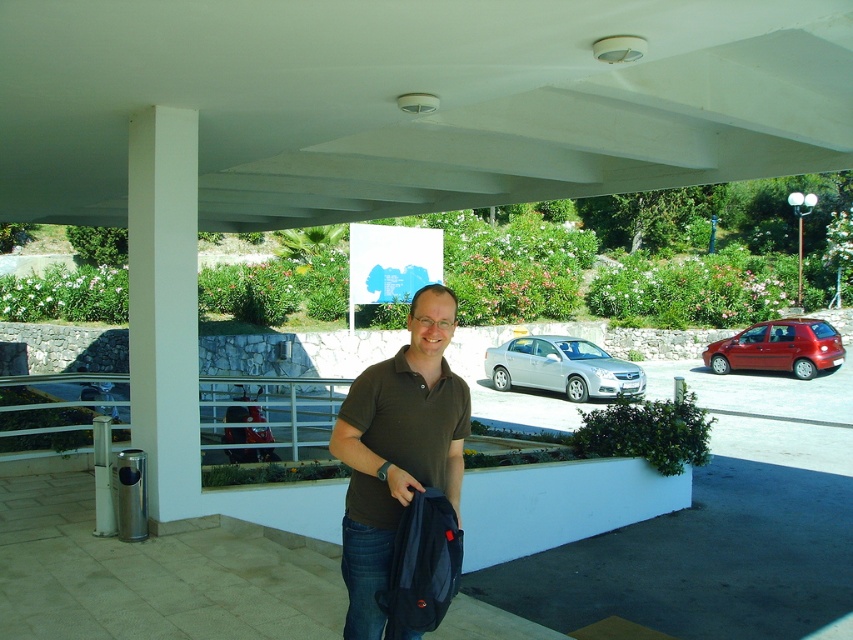
Question: Is the position of white smooth pillar at left less distant than that of brown cotton shirt at center?

Choices:
 (A) yes
 (B) no

Answer: (B)

Question: Considering the real-world distances, which object is closest to the dark gray fabric backpack at center?

Choices:
 (A) silver metallic sedan at center
 (B) shiny red car at right

Answer: (A)

Question: Is dark gray fabric backpack at center positioned in front of shiny red car at right?

Choices:
 (A) yes
 (B) no

Answer: (A)

Question: Does white smooth pillar at left have a smaller size compared to shiny red car at right?

Choices:
 (A) no
 (B) yes

Answer: (B)

Question: Which of the following is the farthest from the observer?

Choices:
 (A) shiny red car at right
 (B) silver metallic sedan at center

Answer: (A)

Question: Which object appears farthest from the camera in this image?

Choices:
 (A) white matte ceiling at upper center
 (B) brown cotton shirt at center

Answer: (A)